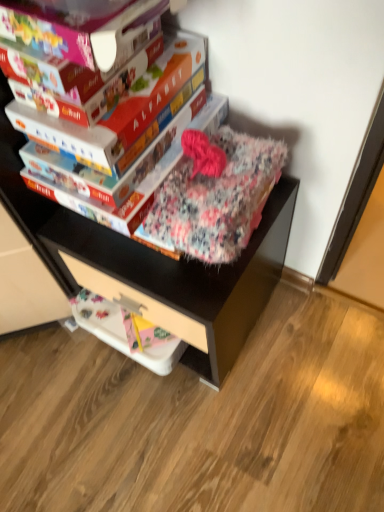
Question: Is matte cardboard book at center, positioned as the 1th paperback book in back-to-front order, not within white plastic drawer at lower center?

Choices:
 (A) yes
 (B) no

Answer: (A)

Question: Does matte cardboard book at center, positioned as the 1th paperback book in back-to-front order, have a greater width compared to white plastic drawer at lower center?

Choices:
 (A) yes
 (B) no

Answer: (A)

Question: Are matte cardboard book at center, the 3th paperback book in the front-to-back sequence, and white plastic drawer at lower center located far from each other?

Choices:
 (A) yes
 (B) no

Answer: (B)

Question: Is matte cardboard book at center, positioned as the 1th paperback book in back-to-front order, aimed at white plastic drawer at lower center?

Choices:
 (A) yes
 (B) no

Answer: (B)

Question: From the image's perspective, would you say matte cardboard book at center, the 3th paperback book in the front-to-back sequence, is shown under white plastic drawer at lower center?

Choices:
 (A) yes
 (B) no

Answer: (B)

Question: Considering the positions of point (102, 148) and point (205, 225), is point (102, 148) closer or farther from the camera than point (205, 225)?

Choices:
 (A) farther
 (B) closer

Answer: (B)

Question: From the image's perspective, relative to fluffy floral blanket at center, is matte cardboard book at upper center, the second paperback book from the back, above or below?

Choices:
 (A) above
 (B) below

Answer: (A)

Question: Considering their positions, is matte cardboard book at upper center, the second paperback book from the back, located in front of or behind fluffy floral blanket at center?

Choices:
 (A) front
 (B) behind

Answer: (B)

Question: Is matte cardboard book at upper center, the 2th paperback book in the front-to-back sequence, wider or thinner than fluffy floral blanket at center?

Choices:
 (A) thin
 (B) wide

Answer: (B)

Question: Does point click(x=72, y=262) appear closer or farther from the camera than point click(x=31, y=30)?

Choices:
 (A) farther
 (B) closer

Answer: (A)

Question: From a real-world perspective, is white plastic drawer at lower center positioned above or below matte cardboard book at upper left, positioned as the first paperback book in front-to-back order?

Choices:
 (A) above
 (B) below

Answer: (B)

Question: Considering the positions of white plastic drawer at lower center and matte cardboard book at upper left, the third paperback book when ordered from back to front, in the image, is white plastic drawer at lower center wider or thinner than matte cardboard book at upper left, the third paperback book when ordered from back to front,?

Choices:
 (A) wide
 (B) thin

Answer: (B)

Question: From the image's perspective, is white plastic drawer at lower center positioned above or below matte cardboard book at upper left, the third paperback book when ordered from back to front?

Choices:
 (A) above
 (B) below

Answer: (B)

Question: From a real-world perspective, is white plastic drawer at lower center above or below matte cardboard book at upper center, the 2th paperback book in the front-to-back sequence?

Choices:
 (A) above
 (B) below

Answer: (B)

Question: Considering the positions of white plastic drawer at lower center and matte cardboard book at upper center, the 2th paperback book in the front-to-back sequence, in the image, is white plastic drawer at lower center taller or shorter than matte cardboard book at upper center, the 2th paperback book in the front-to-back sequence,?

Choices:
 (A) short
 (B) tall

Answer: (A)